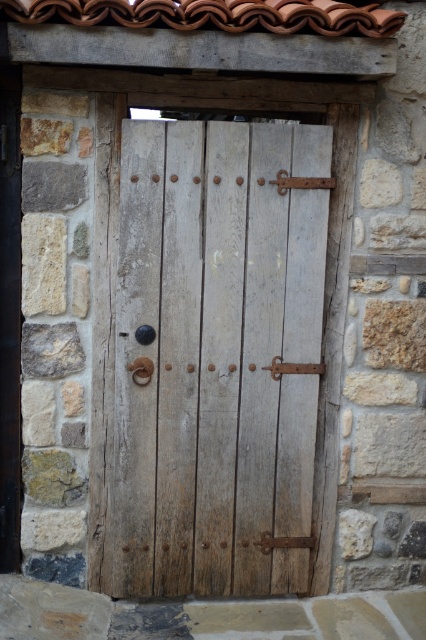
Question: Observing the image, what is the correct spatial positioning of weathered wood door at center in reference to terracotta clay tiles at upper center?

Choices:
 (A) above
 (B) below

Answer: (B)

Question: Does weathered wood door at center have a greater width compared to terracotta clay tiles at upper center?

Choices:
 (A) yes
 (B) no

Answer: (B)

Question: Which point appears farthest from the camera in this image?

Choices:
 (A) (250, 3)
 (B) (235, 180)

Answer: (B)

Question: Which object is farther from the camera taking this photo?

Choices:
 (A) terracotta clay tiles at upper center
 (B) weathered wood door at center

Answer: (B)

Question: Is weathered wood door at center above terracotta clay tiles at upper center?

Choices:
 (A) no
 (B) yes

Answer: (A)

Question: Which object appears closest to the camera in this image?

Choices:
 (A) weathered wood door at center
 (B) terracotta clay tiles at upper center

Answer: (B)